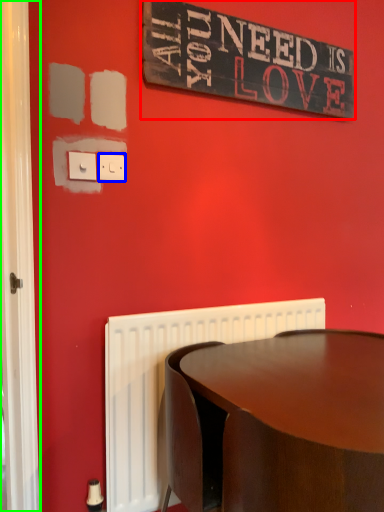
Question: Estimate the real-world distances between objects in this image. Which object is closer to bulletin board (highlighted by a red box), electric outlet (highlighted by a blue box) or screen door (highlighted by a green box)?

Choices:
 (A) electric outlet
 (B) screen door

Answer: (A)